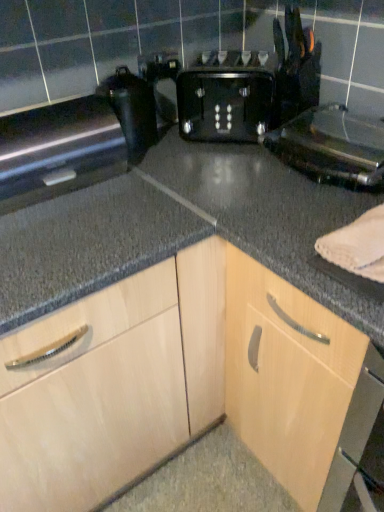
Locate an element on the screen. The height and width of the screenshot is (512, 384). free spot in front of black glossy coffee maker at upper left, placed as the second appliance when sorted from right to left is located at coordinates (158, 166).